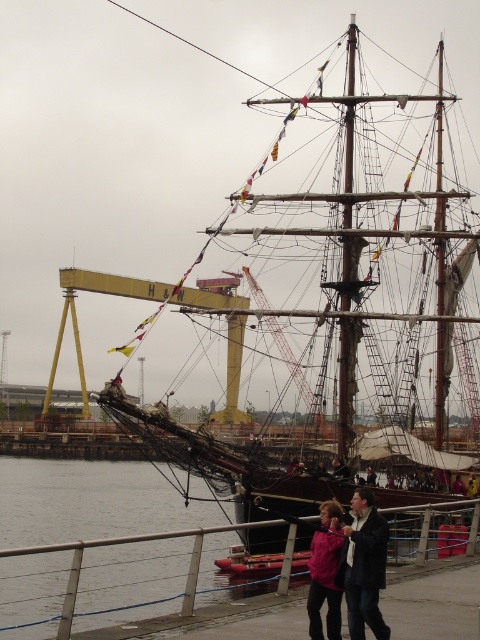
Can you confirm if wooden ship at center is positioned below matte pink jacket at lower center?

No.

Can you confirm if wooden ship at center is wider than matte pink jacket at lower center?

Yes.

This screenshot has height=640, width=480. Describe the element at coordinates (361, 262) in the screenshot. I see `wooden ship at center` at that location.

Find the location of a particular element. This screenshot has width=480, height=640. wooden ship at center is located at coordinates (361, 262).

From the picture: Does clear water at lower left have a greater height compared to matte pink jacket at lower center?

Indeed, clear water at lower left has a greater height compared to matte pink jacket at lower center.

Can you confirm if clear water at lower left is positioned to the right of matte pink jacket at lower center?

Incorrect, clear water at lower left is not on the right side of matte pink jacket at lower center.

Which is behind, point (225, 540) or point (339, 625)?

Positioned behind is point (225, 540).

I want to click on clear water at lower left, so click(x=90, y=500).

Is point (110, 472) behind point (346, 598)?

Yes, it is.

Is clear water at lower left wider than dark pink fabric jacket at lower center?

Yes, clear water at lower left is wider than dark pink fabric jacket at lower center.

Is point (106, 554) positioned after point (340, 564)?

Yes, point (106, 554) is behind point (340, 564).

Find the location of `clear water at lower left`. clear water at lower left is located at coordinates (90, 500).